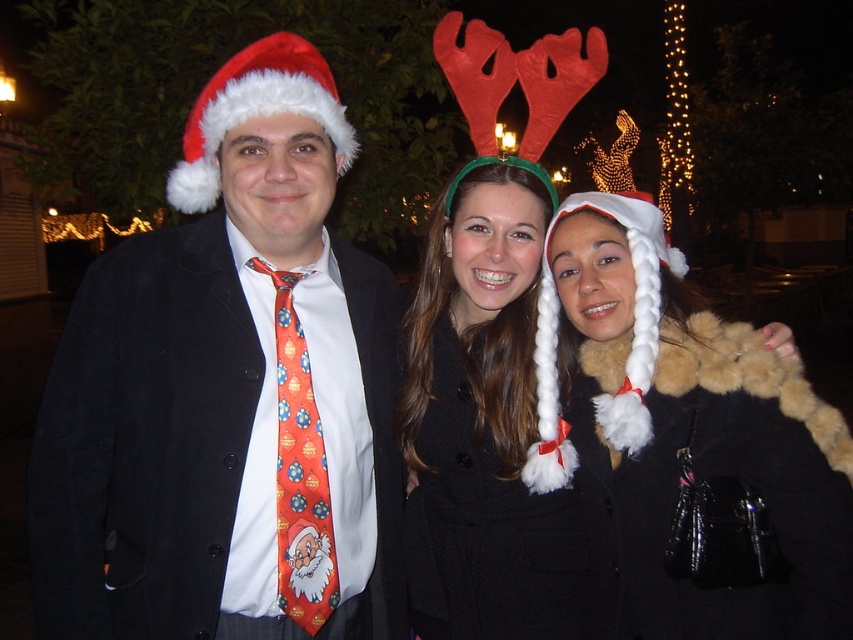
Question: Which of the following is the closest to the observer?

Choices:
 (A) black wool coat at center
 (B) matte black coat at center
 (C) orange printed tie at left

Answer: (B)

Question: Where is matte black coat at center located in relation to orange printed tie at left in the image?

Choices:
 (A) left
 (B) right

Answer: (A)

Question: Is fuzzy black coat at center above black wool coat at center?

Choices:
 (A) no
 (B) yes

Answer: (B)

Question: Which of the following is the closest to the observer?

Choices:
 (A) (630, 344)
 (B) (303, 564)

Answer: (B)

Question: Does fuzzy black coat at center appear on the right side of orange printed tie at left?

Choices:
 (A) yes
 (B) no

Answer: (A)

Question: Which of these objects is positioned closest to the black wool coat at center?

Choices:
 (A) matte black coat at center
 (B) fuzzy black coat at center

Answer: (B)